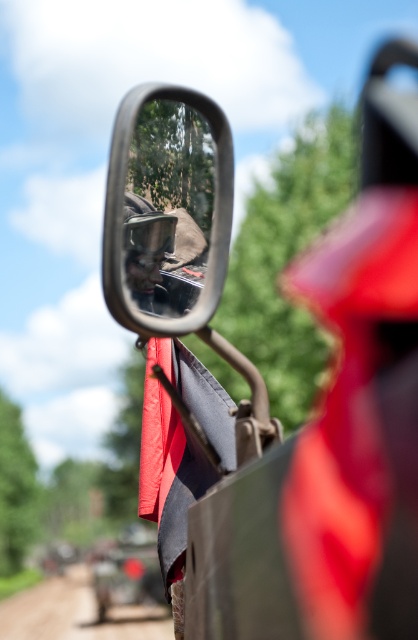
Question: Is clear plastic mirror at center wider than dirt track at lower left?

Choices:
 (A) yes
 (B) no

Answer: (B)

Question: Which point is closer to the camera?

Choices:
 (A) (30, 588)
 (B) (145, 125)

Answer: (B)

Question: Which point appears closest to the camera in this image?

Choices:
 (A) (102, 628)
 (B) (148, 170)

Answer: (B)

Question: Does clear plastic mirror at center have a larger size compared to dirt track at lower left?

Choices:
 (A) no
 (B) yes

Answer: (A)

Question: Among these objects, which one is farthest from the camera?

Choices:
 (A) clear plastic mirror at center
 (B) dirt track at lower left

Answer: (B)

Question: Is clear plastic mirror at center behind dirt track at lower left?

Choices:
 (A) yes
 (B) no

Answer: (B)